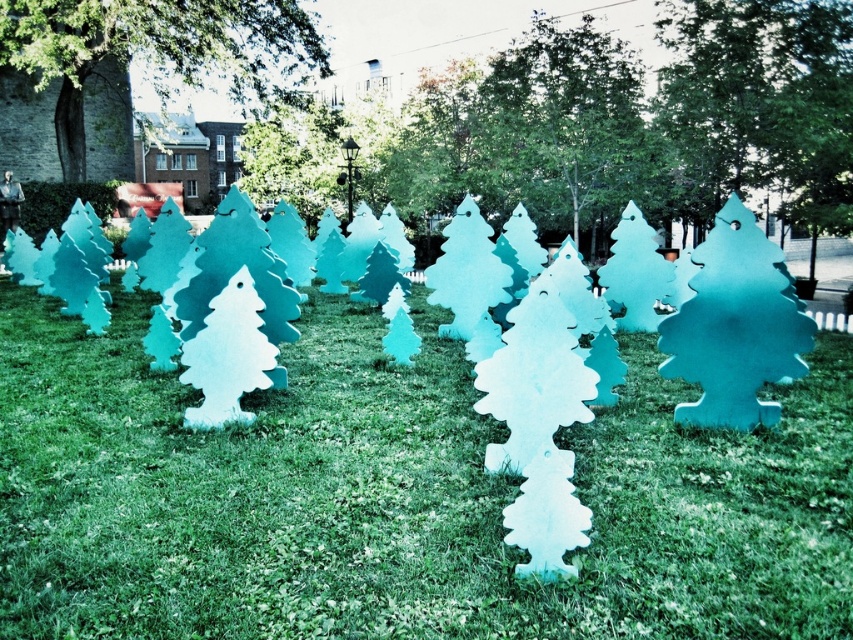
You are standing at the center of the grassy area and want to place a new decoration exactly where the matte teal tree at center is currently located. According to the coordinates provided, where should you place your new decoration?

You should place your new decoration at the coordinates point [637,122] where the matte teal tree at center is located.

Based on the photo, you are standing in the grassy area and want to place a small flag exactly halfway between the matte white grass at center and the smooth green tree at upper center. Will the flag be closer to the grass or the tree?

The flag will be closer to the matte white grass at center because it is located below the smooth green tree at upper center, so the halfway point would still be nearer to the grass.